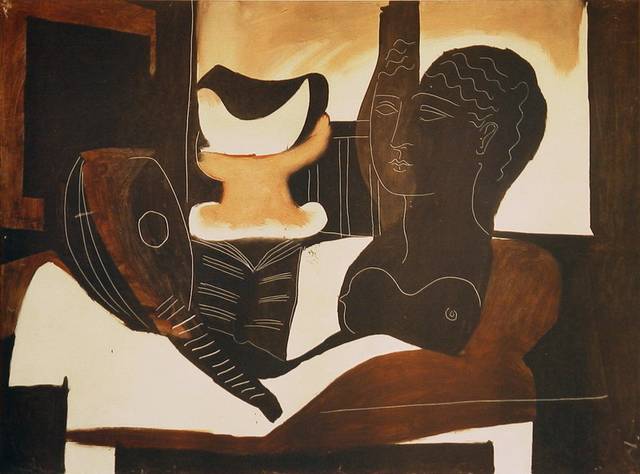
Locate an element on the screen. The image size is (640, 474). chest is located at coordinates (372, 290), (444, 312).